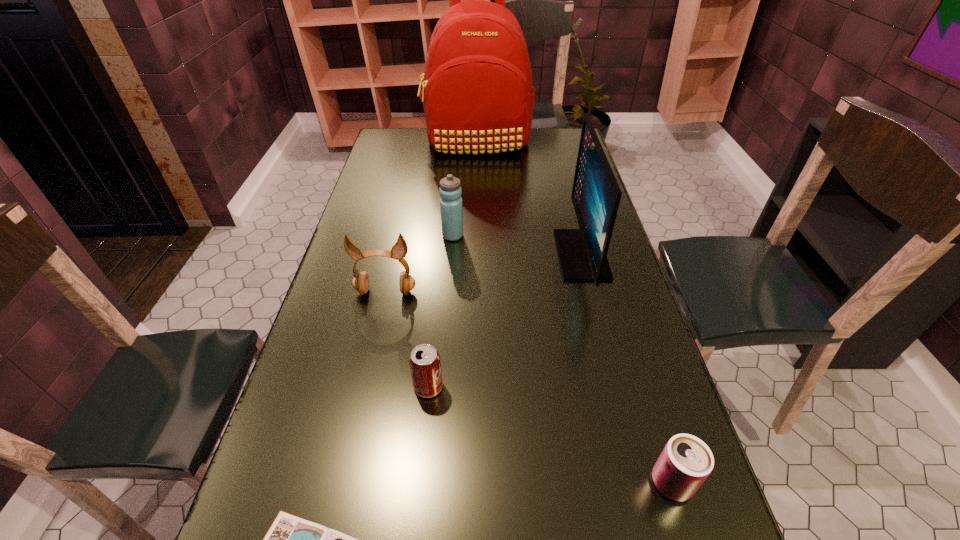
At what (x,y) coordinates should I click in order to perform the action: click on backpack. Please return your answer as a coordinate pair (x, y). Looking at the image, I should click on (477, 94).

Identify the location of the farthest object. This screenshot has height=540, width=960. (477, 94).

What are the coordinates of `monitor` in the screenshot? It's located at (596, 195).

Where is `water bottle`? This screenshot has width=960, height=540. water bottle is located at coordinates (450, 190).

Where is `earphone`? Image resolution: width=960 pixels, height=540 pixels. earphone is located at coordinates (360, 282).

I want to click on soda can, so click(425, 365).

Identify the location of the sixth farthest object. (686, 461).

This screenshot has height=540, width=960. What are the coordinates of `vacant region located on the front-facing side of the farthest object` in the screenshot? It's located at (476, 177).

This screenshot has height=540, width=960. In order to click on vacant space located 0.170m on the screen side of the second tallest object in this screenshot , I will do `click(500, 255)`.

Locate an element on the screen. This screenshot has height=540, width=960. free space located on the screen side of the second tallest object is located at coordinates (496, 255).